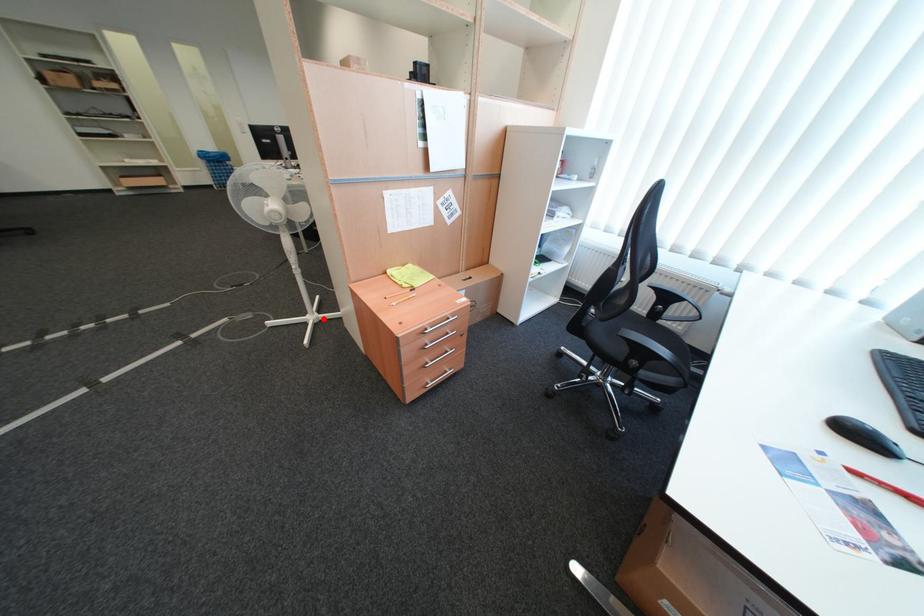
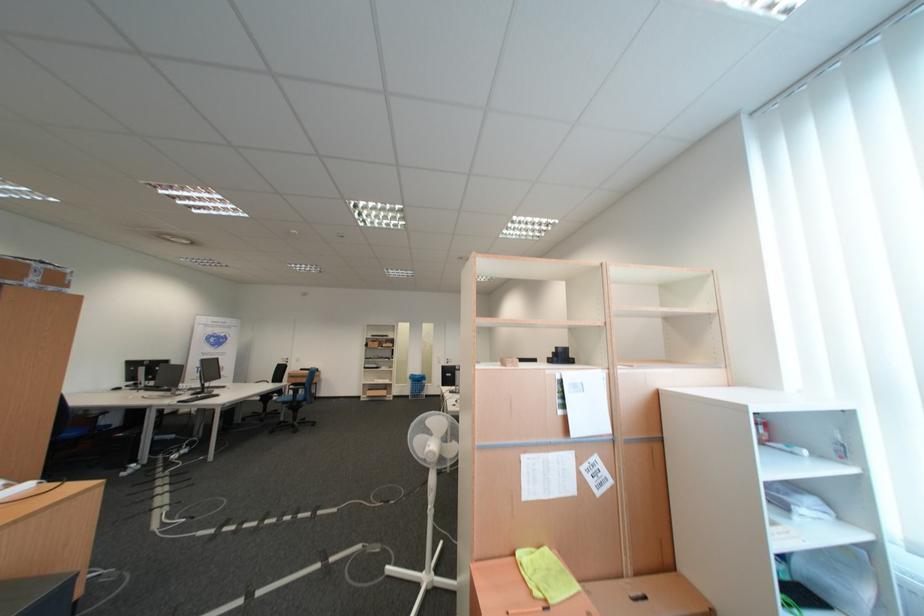
Question: I am providing you with two images of the same scene from different viewpoints. In image1, a red point is highlighted. Considering the same 3D point in image2, which of the following is correct?

Choices:
 (A) It is closer
 (B) It is farther

Answer: (A)